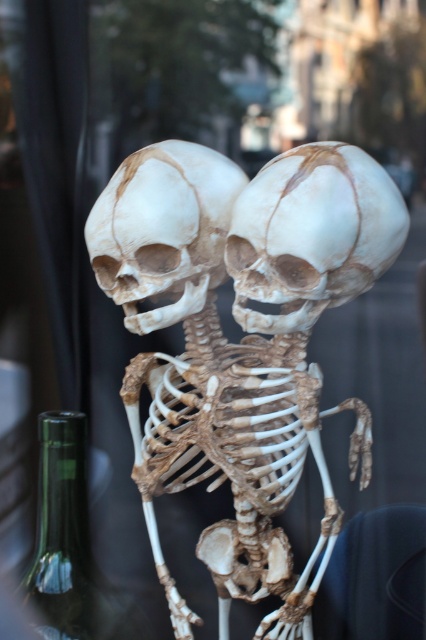
You are a delivery person who needs to place a new white matte skull at center into a storage box that can hold up to the width of the brown textured skeleton at center. Can the skull fit into the box?

Answer: The brown textured skeleton at center might be wider than white matte skull at center, so the storage box designed for the skeleton should be large enough to accommodate the skull since the skull is likely narrower.

You are standing in front of a store window and notice the brown textured skeleton at center. Can you determine if the skeleton is positioned closer to the left or right side of the window based on its coordinates?

The brown textured skeleton at center is located at point 0.536 on the horizontal axis, which is slightly to the right of the center point 0.5. Therefore, the skeleton is positioned closer to the right side of the window.

You are a delivery person who needs to place a package between the white matte skull at center and the green glass bottle at lower left. Can you fit the package there if it is 1 meter wide?

The white matte skull at center is positioned on the right side of green glass bottle at lower left, so the distance between them is not specified. Without knowing the exact distance, it is impossible to determine if the package will fit.